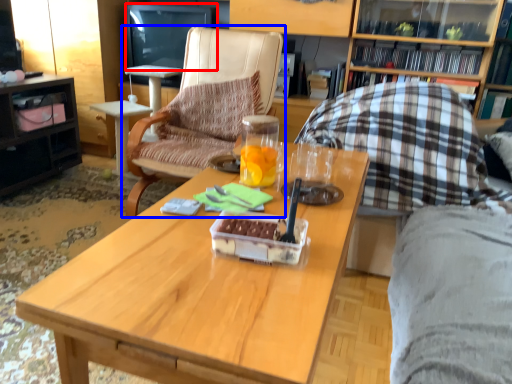
Question: Among these objects, which one is nearest to the camera, television (highlighted by a red box) or chair (highlighted by a blue box)?

Choices:
 (A) television
 (B) chair

Answer: (B)